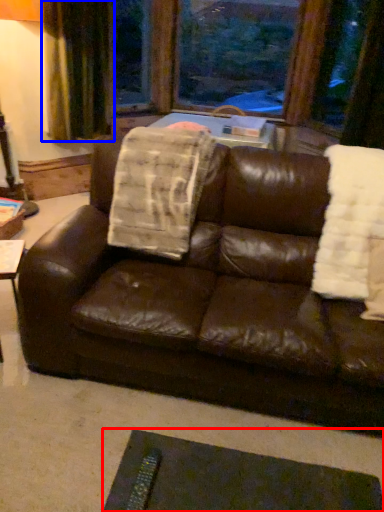
Question: Which object is further to the camera taking this photo, flat (highlighted by a red box) or curtain (highlighted by a blue box)?

Choices:
 (A) flat
 (B) curtain

Answer: (B)